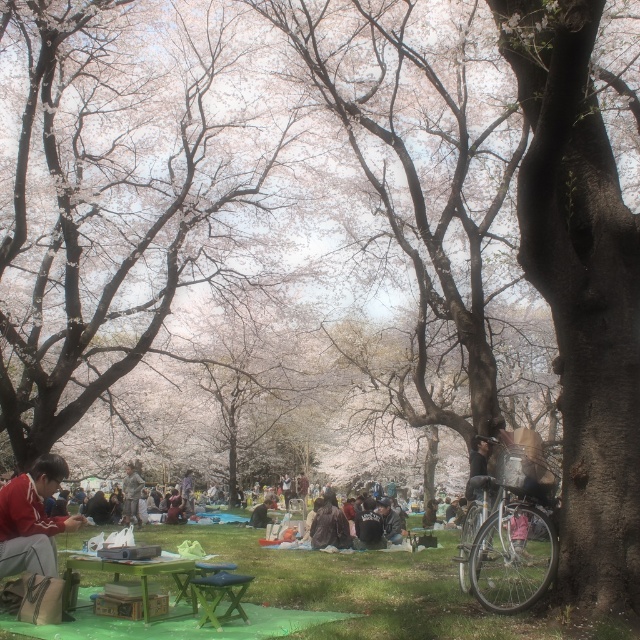
Question: Is green wood picnic table at lower center wider than green wood park bench at center?

Choices:
 (A) yes
 (B) no

Answer: (A)

Question: Based on their relative distances, which object is farther from the green wood picnic table at lower center?

Choices:
 (A) green wood park bench at center
 (B) wooden statue at center
 (C) green grass at lower center

Answer: (B)

Question: Does green wood picnic table at lower center have a larger size compared to green wood park bench at center?

Choices:
 (A) no
 (B) yes

Answer: (B)

Question: Which point is farther to the camera?

Choices:
 (A) (204, 616)
 (B) (177, 557)
 (C) (310, 588)
 (D) (129, 518)

Answer: (D)

Question: Which point appears farthest from the camera in this image?

Choices:
 (A) (141, 483)
 (B) (61, 577)
 (C) (211, 589)
 (D) (422, 570)

Answer: (A)

Question: Considering the relative positions of green wood park bench at center and wooden statue at center in the image provided, where is green wood park bench at center located with respect to wooden statue at center?

Choices:
 (A) left
 (B) right

Answer: (B)